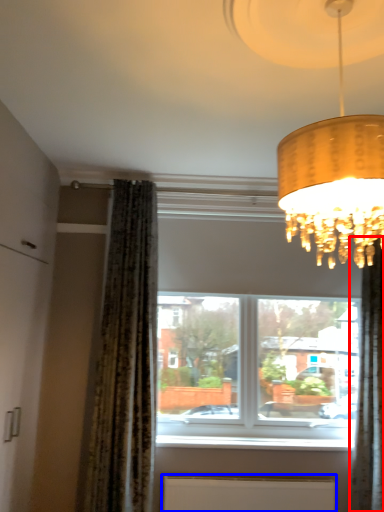
Question: Which point is closer to the camera, curtain (highlighted by a red box) or radiator (highlighted by a blue box)?

Choices:
 (A) curtain
 (B) radiator

Answer: (A)